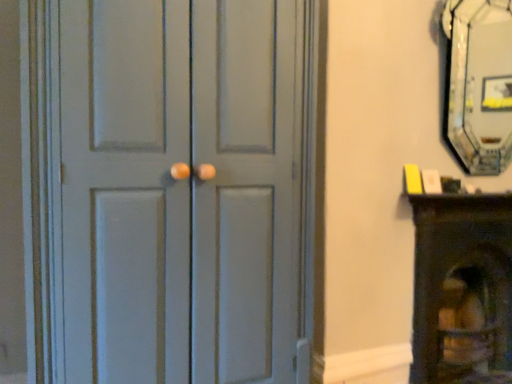
Find the location of a particular element. black glass fireplace at upper right is located at coordinates (479, 83).

Find the location of a particular element. The height and width of the screenshot is (384, 512). matte gray door at center is located at coordinates (179, 190).

Describe the element at coordinates (462, 289) in the screenshot. I see `wooden fireplace at right` at that location.

At what (x,y) coordinates should I click in order to perform the action: click on black glass fireplace at upper right. Please return your answer as a coordinate pair (x, y). Looking at the image, I should click on (479, 83).

Based on their sizes in the image, would you say black glass fireplace at upper right is bigger or smaller than matte gray door at center?

In the image, black glass fireplace at upper right appears to be smaller than matte gray door at center.

Is black glass fireplace at upper right with matte gray door at center?

black glass fireplace at upper right and matte gray door at center are clearly separated.

Is black glass fireplace at upper right inside or outside of matte gray door at center?

black glass fireplace at upper right is not inside matte gray door at center, it's outside.

From the image's perspective, between black glass fireplace at upper right and matte gray door at center, which one is located above?

black glass fireplace at upper right, from the image's perspective.

Could you tell me if matte gray door at center is facing wooden fireplace at right?

No, matte gray door at center does not turn towards wooden fireplace at right.

Is matte gray door at center smaller than wooden fireplace at right?

No.

Consider the image. From the image's perspective, which is below, matte gray door at center or wooden fireplace at right?

wooden fireplace at right is shown below in the image.

Considering the relative positions of matte gray door at center and black glass fireplace at upper right in the image provided, is matte gray door at center in front of black glass fireplace at upper right?

Yes, matte gray door at center is closer to the viewer.

Considering the sizes of objects matte gray door at center and black glass fireplace at upper right in the image provided, who is taller, matte gray door at center or black glass fireplace at upper right?

Standing taller between the two is matte gray door at center.

Find the location of a particular element. This screenshot has height=384, width=512. fireplace behind the matte gray door at center is located at coordinates (479, 83).

In terms of width, does matte gray door at center look wider or thinner when compared to black glass fireplace at upper right?

matte gray door at center is wider than black glass fireplace at upper right.

In the scene shown: Is black glass fireplace at upper right next to wooden fireplace at right?

No, black glass fireplace at upper right is not in contact with wooden fireplace at right.

Is wooden fireplace at right surrounded by black glass fireplace at upper right?

No, wooden fireplace at right is not a part of black glass fireplace at upper right.

Where is `fireplace that is in front of the wooden fireplace at right`? The height and width of the screenshot is (384, 512). fireplace that is in front of the wooden fireplace at right is located at coordinates (479, 83).

Is wooden fireplace at right at the back of black glass fireplace at upper right?

No, black glass fireplace at upper right is not facing away from wooden fireplace at right.

From the image's perspective, is wooden fireplace at right on black glass fireplace at upper right?

No, from the image's perspective, wooden fireplace at right is not on top of black glass fireplace at upper right.

Which of these two, wooden fireplace at right or black glass fireplace at upper right, stands shorter?

With less height is black glass fireplace at upper right.

Is black glass fireplace at upper right located within wooden fireplace at right?

→ That's incorrect, black glass fireplace at upper right is not inside wooden fireplace at right.

Is wooden fireplace at right directly adjacent to black glass fireplace at upper right?

No, wooden fireplace at right is not next to black glass fireplace at upper right.

Based on the photo, is the depth of wooden fireplace at right less than that of matte gray door at center?

No, it is behind matte gray door at center.

From the picture: Considering the relative positions of wooden fireplace at right and matte gray door at center in the image provided, is wooden fireplace at right to the left of matte gray door at center from the viewer's perspective?

No, wooden fireplace at right is not to the left of matte gray door at center.

Can you tell me how much wooden fireplace at right and matte gray door at center differ in facing direction?

The angular difference between wooden fireplace at right and matte gray door at center is 0.345 degrees.

From a real-world perspective, is wooden fireplace at right positioned above or below matte gray door at center?

From a real-world perspective, wooden fireplace at right is physically below matte gray door at center.

At what (x,y) coordinates should I click in order to perform the action: click on door in front of the black glass fireplace at upper right. Please return your answer as a coordinate pair (x, y). This screenshot has width=512, height=384. Looking at the image, I should click on click(179, 190).

In order to click on furniture below the matte gray door at center (from a real-world perspective) in this screenshot , I will do `click(462, 289)`.

When comparing their distances from black glass fireplace at upper right, does matte gray door at center or wooden fireplace at right seem closer?

Result: wooden fireplace at right is closer to black glass fireplace at upper right.

Which object lies further to the anchor point matte gray door at center, black glass fireplace at upper right or wooden fireplace at right?

black glass fireplace at upper right.

Estimate the real-world distances between objects in this image. Which object is further from matte gray door at center, wooden fireplace at right or black glass fireplace at upper right?

black glass fireplace at upper right is further to matte gray door at center.

When comparing their distances from wooden fireplace at right, does matte gray door at center or black glass fireplace at upper right seem further?

black glass fireplace at upper right.

When comparing their distances from black glass fireplace at upper right, does wooden fireplace at right or matte gray door at center seem further?

matte gray door at center is positioned further to the anchor black glass fireplace at upper right.

Which object lies nearer to the anchor point wooden fireplace at right, black glass fireplace at upper right or matte gray door at center?

The object closer to wooden fireplace at right is matte gray door at center.

Identify the location of fireplace between matte gray door at center and wooden fireplace at right from left to right. The image size is (512, 384). (479, 83).